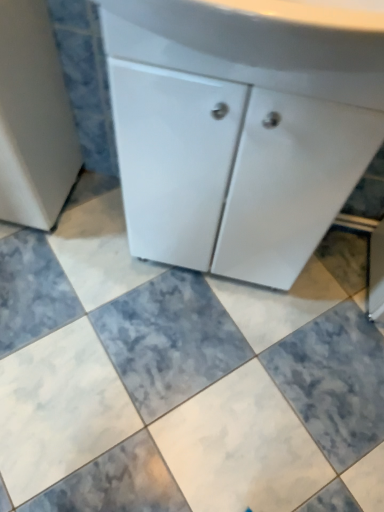
Question: Does marble tile at center have a smaller size compared to white glossy cabinet at center?

Choices:
 (A) yes
 (B) no

Answer: (A)

Question: Is marble tile at center looking in the opposite direction of white glossy cabinet at center?

Choices:
 (A) yes
 (B) no

Answer: (B)

Question: Does marble tile at center come in front of white glossy cabinet at center?

Choices:
 (A) yes
 (B) no

Answer: (B)

Question: Does marble tile at center have a lesser width compared to white glossy cabinet at center?

Choices:
 (A) no
 (B) yes

Answer: (A)

Question: Would you say marble tile at center is outside white glossy cabinet at center?

Choices:
 (A) yes
 (B) no

Answer: (A)

Question: Can you confirm if marble tile at center is positioned to the left of white glossy cabinet at center?

Choices:
 (A) no
 (B) yes

Answer: (B)

Question: Is marble tile at center at the back of white glossy cabinet at center?

Choices:
 (A) no
 (B) yes

Answer: (A)

Question: Is white glossy cabinet at center smaller than marble tile at center?

Choices:
 (A) no
 (B) yes

Answer: (A)

Question: Could you tell me if white glossy cabinet at center is facing marble tile at center?

Choices:
 (A) no
 (B) yes

Answer: (B)

Question: Is white glossy cabinet at center behind marble tile at center?

Choices:
 (A) no
 (B) yes

Answer: (A)

Question: From the image's perspective, does white glossy cabinet at center appear lower than marble tile at center?

Choices:
 (A) yes
 (B) no

Answer: (B)

Question: Is white glossy cabinet at center placed right next to marble tile at center?

Choices:
 (A) no
 (B) yes

Answer: (A)

Question: From the image's perspective, is white glossy cabinet at center on white glossy cabinet at upper center?

Choices:
 (A) yes
 (B) no

Answer: (B)